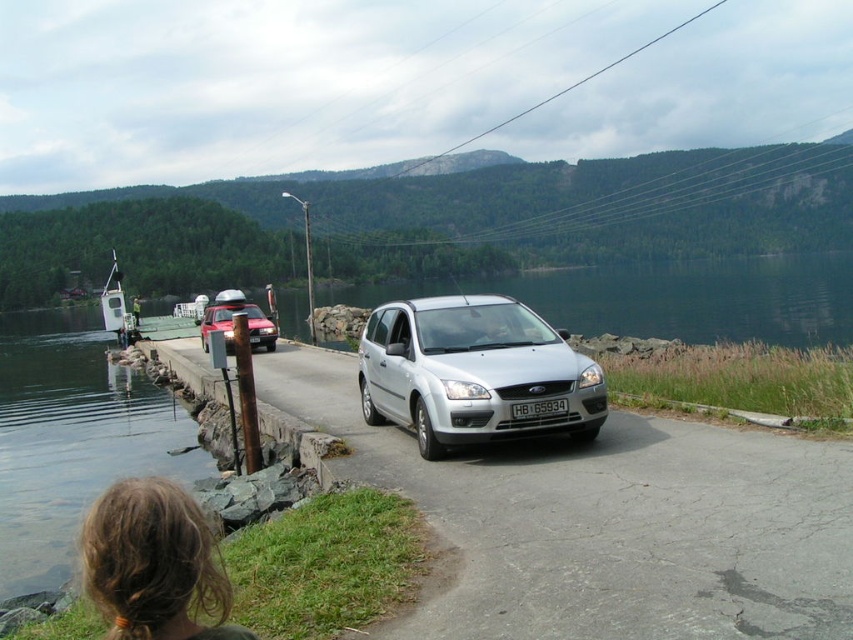
Question: Does clear water at dock left appear on the left side of brown hair at lower left?

Choices:
 (A) yes
 (B) no

Answer: (A)

Question: Observing the image, what is the correct spatial positioning of clear water at center in reference to brown hair at lower left?

Choices:
 (A) left
 (B) right

Answer: (B)

Question: Estimate the real-world distances between objects in this image. Which object is closer to the matte red car at left?

Choices:
 (A) brown hair at lower left
 (B) silver metallic hatchback at center
 (C) clear water at center

Answer: (B)

Question: Which point is closer to the camera?

Choices:
 (A) clear water at center
 (B) brown hair at lower left
 (C) matte red car at left

Answer: (B)

Question: Which object appears closest to the camera in this image?

Choices:
 (A) brown hair at lower left
 (B) silver metallic hatchback at center

Answer: (A)

Question: Is clear water at dock left to the left of silver metallic hatchback at center from the viewer's perspective?

Choices:
 (A) yes
 (B) no

Answer: (A)